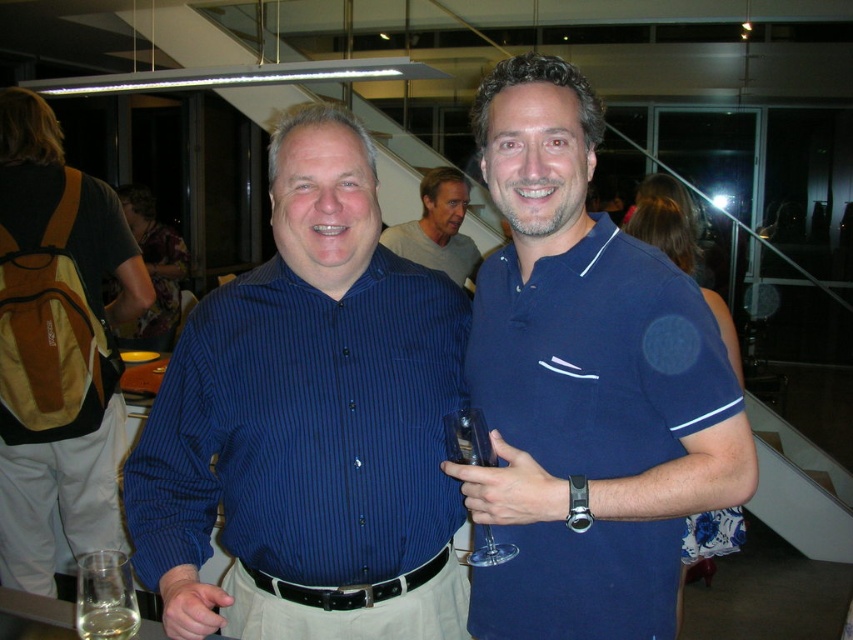
You are a bartender standing at the bar counter. You see the clear glass wine glass at lower left. Can you reach it from your current position?

The clear glass wine glass at lower left is 3.36 feet away from you. Since the average reach of a bartender is about 3 feet, you might need to take a step forward to reach it.

You are a photographer at the event and want to capture a closeup of the clear glass wine glass at lower left without the translucent glass at lower left appearing in the shot. Is this possible given their positions?

The clear glass wine glass at lower left is closer to the viewer than the translucent glass at lower left, so you can focus on the clear glass wine glass at lower left and position the camera so the translucent glass at lower left is out of frame behind it.